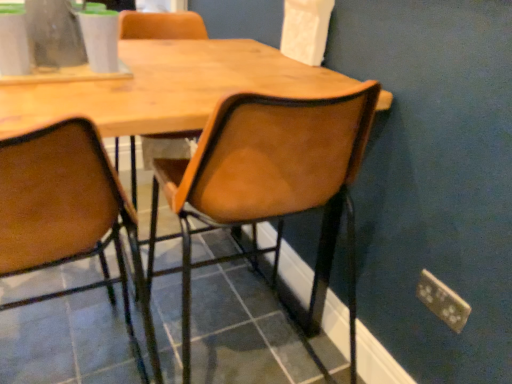
The width and height of the screenshot is (512, 384). Identify the location of free spot in front of clear glass vase at upper left. click(x=56, y=93).